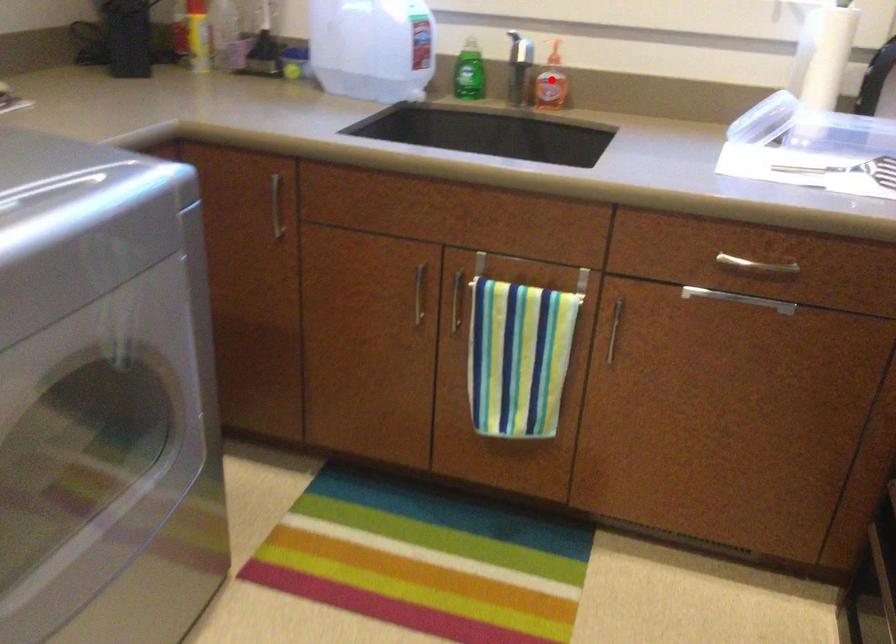
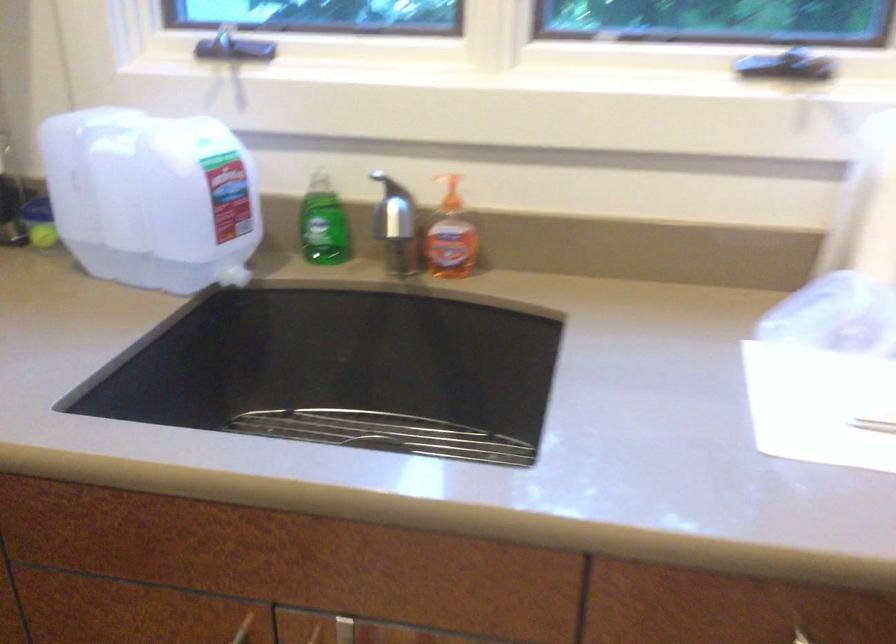
In the second image, find the point that corresponds to the highlighted location in the first image.

(451, 236)